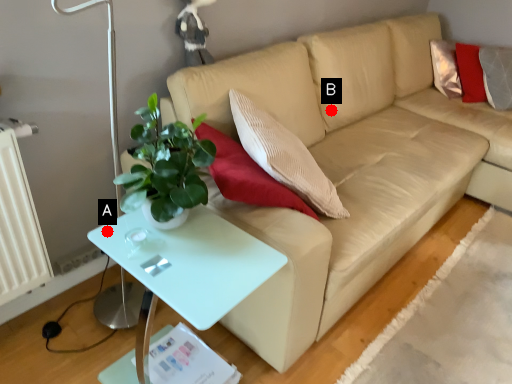
Question: Two points are circled on the image, labeled by A and B beside each circle. Among these points, which one is farthest from the camera?

Choices:
 (A) A is further
 (B) B is further

Answer: (B)